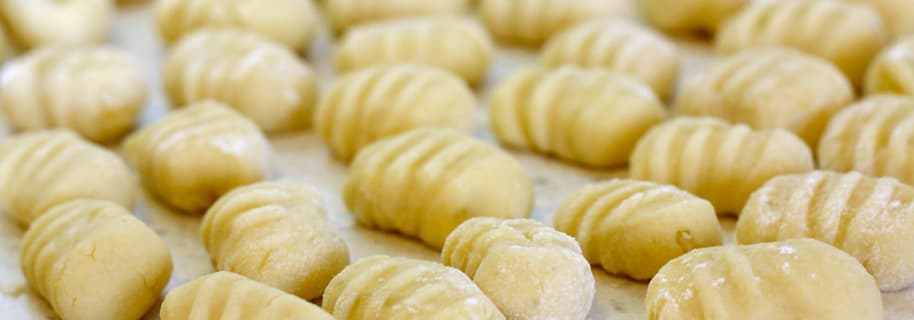
In order to click on parchment on baking pan in this screenshot , I will do `click(141, 32)`.